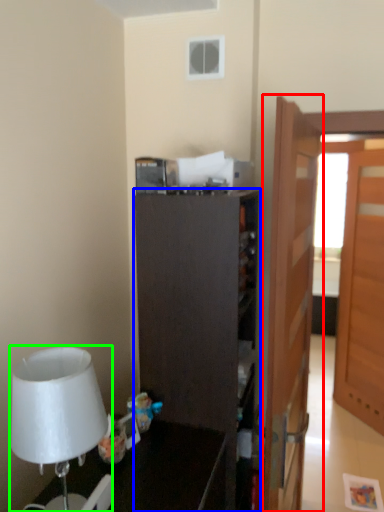
Question: Which is nearer to the door (highlighted by a red box)? cabinetry (highlighted by a blue box) or lamp (highlighted by a green box).

Choices:
 (A) cabinetry
 (B) lamp

Answer: (A)